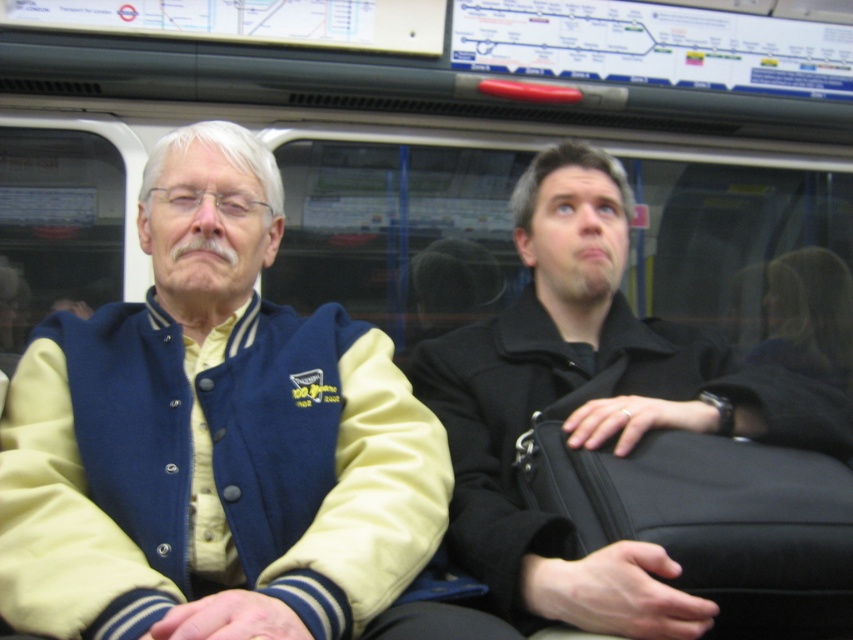
Which is below, varnished leather jacket at center or black fabric suitcase at right?

Positioned lower is black fabric suitcase at right.

Is varnished leather jacket at center thinner than black fabric suitcase at right?

No.

At what (x,y) coordinates should I click in order to perform the action: click on varnished leather jacket at center. Please return your answer as a coordinate pair (x, y). Looking at the image, I should click on (212, 444).

Can you confirm if black leather jacket at center is positioned to the left of black fabric suitcase at right?

Yes, black leather jacket at center is to the left of black fabric suitcase at right.

Can you confirm if black leather jacket at center is wider than black fabric suitcase at right?

Yes.

The height and width of the screenshot is (640, 853). Find the location of `black leather jacket at center`. black leather jacket at center is located at coordinates (590, 406).

The width and height of the screenshot is (853, 640). What are the coordinates of `black leather jacket at center` in the screenshot? It's located at (590, 406).

Does varnished leather jacket at center have a smaller size compared to black leather jacket at center?

Indeed, varnished leather jacket at center has a smaller size compared to black leather jacket at center.

Does varnished leather jacket at center have a greater height compared to black leather jacket at center?

Incorrect, varnished leather jacket at center's height is not larger of black leather jacket at center's.

Is point (67, 468) less distant than point (735, 417)?

Yes, it is in front of point (735, 417).

The width and height of the screenshot is (853, 640). I want to click on varnished leather jacket at center, so [212, 444].